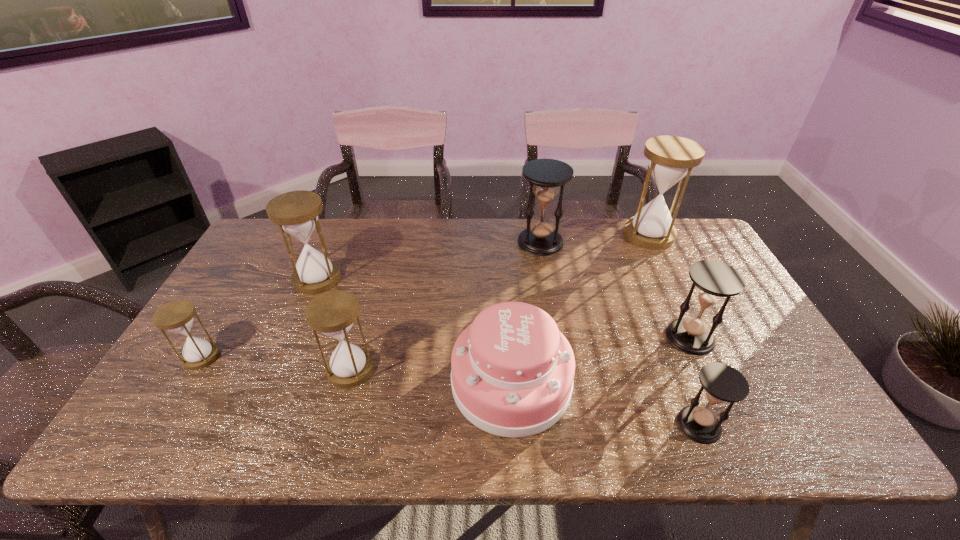
This screenshot has width=960, height=540. What are the coordinates of `vacant space that's between the birthday cake and the third object from left to right` in the screenshot? It's located at (431, 376).

Where is `free space that is in between the third farthest hourglass and the smallest white hourglass`? The height and width of the screenshot is (540, 960). free space that is in between the third farthest hourglass and the smallest white hourglass is located at coordinates (259, 318).

This screenshot has width=960, height=540. Find the location of `empty space between the leftmost hourglass and the second nearest black hourglass`. empty space between the leftmost hourglass and the second nearest black hourglass is located at coordinates (445, 347).

The width and height of the screenshot is (960, 540). Find the location of `empty space that is in between the nearest hourglass and the biggest black hourglass`. empty space that is in between the nearest hourglass and the biggest black hourglass is located at coordinates (619, 334).

Where is `vacant space in between the birthday cake and the second farthest black hourglass`? Image resolution: width=960 pixels, height=540 pixels. vacant space in between the birthday cake and the second farthest black hourglass is located at coordinates (601, 360).

Where is `blank region between the second biggest black hourglass and the smallest white hourglass`? blank region between the second biggest black hourglass and the smallest white hourglass is located at coordinates (445, 347).

The width and height of the screenshot is (960, 540). In order to click on free space between the biggest black hourglass and the leftmost white hourglass in this screenshot , I will do `click(371, 300)`.

This screenshot has height=540, width=960. I want to click on vacant area between the leftmost white hourglass and the second smallest black hourglass, so click(445, 347).

Identify which object is the sixth closest to the leftmost object. Please provide its 2D coordinates. Your answer should be formatted as a tuple, i.e. [(x, y)], where the tuple contains the x and y coordinates of a point satisfying the conditions above.

[(714, 280)]

Choose which object is the seventh nearest neighbor to the nearest hourglass. Please provide its 2D coordinates. Your answer should be formatted as a tuple, i.e. [(x, y)], where the tuple contains the x and y coordinates of a point satisfying the conditions above.

[(177, 316)]